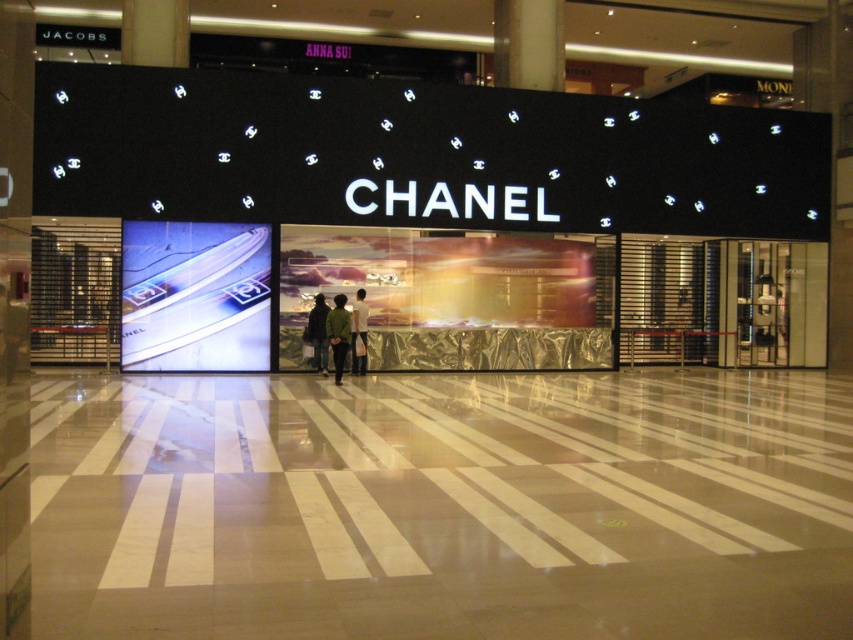
You are a customer standing in front of the Chanel store entrance. You notice two items displayed at the center area. Which item is placed lower between the black leather jacket at center and the white fabric shirt at center?

The black leather jacket at center is positioned under the white fabric shirt at center, so it is placed lower.

You are a customer entering the Chanel store and see both the black leather jacket at center and the white fabric shirt at center. Which item is closer to you as you face the store entrance?

The black leather jacket at center is closer to you because it is in front of the white fabric shirt at center.